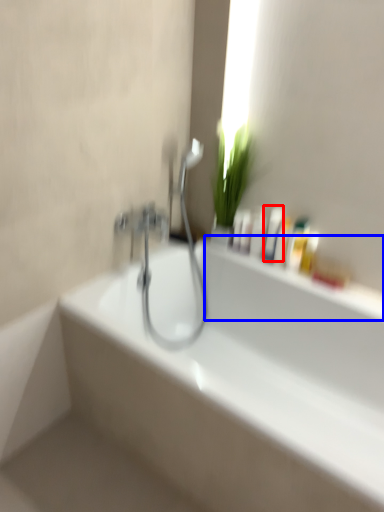
Question: Which object is closer to the camera taking this photo, mouthwash (highlighted by a red box) or window sill (highlighted by a blue box)?

Choices:
 (A) mouthwash
 (B) window sill

Answer: (B)